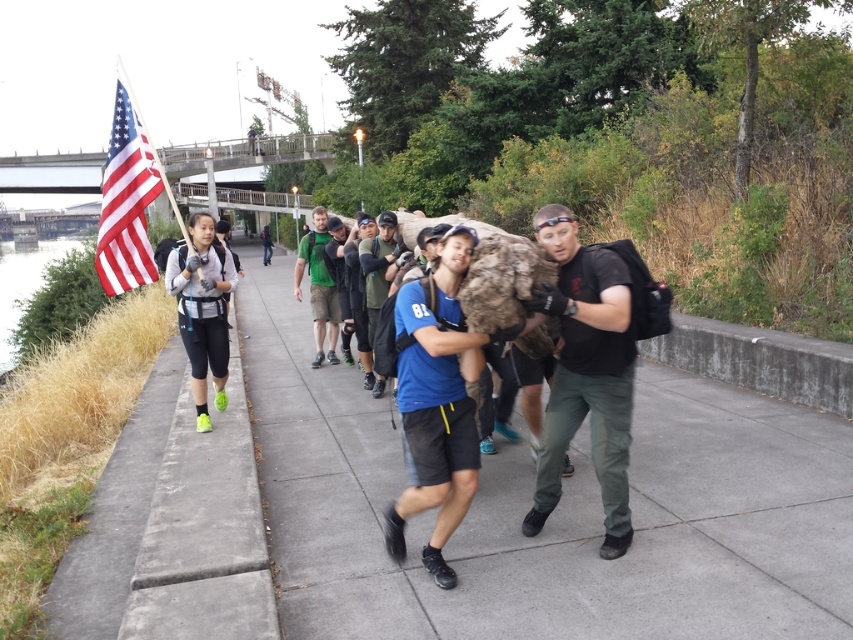
Question: Which point is farther to the camera?

Choices:
 (A) black matte shirt at center
 (B) green fabric shirt at center
 (C) matte black backpack at left

Answer: (B)

Question: Estimate the real-world distances between objects in this image. Which object is farther from the black matte shirt at center?

Choices:
 (A) dark gray hoodie at center
 (B) red-white striped fabric flag at upper left
 (C) green fabric shirt at center

Answer: (A)

Question: Is concrete sidewalk at center smaller than red-white striped fabric flag at upper left?

Choices:
 (A) no
 (B) yes

Answer: (B)

Question: Which object is the farthest from the concrete sidewalk at center?

Choices:
 (A) red-white striped fabric flag at upper left
 (B) green fabric shirt at center
 (C) dark gray hoodie at center
 (D) matte black backpack at left

Answer: (C)

Question: Does concrete sidewalk at center have a lesser width compared to matte black backpack at left?

Choices:
 (A) no
 (B) yes

Answer: (A)

Question: Is black matte shirt at center behind dark gray hoodie at center?

Choices:
 (A) no
 (B) yes

Answer: (A)